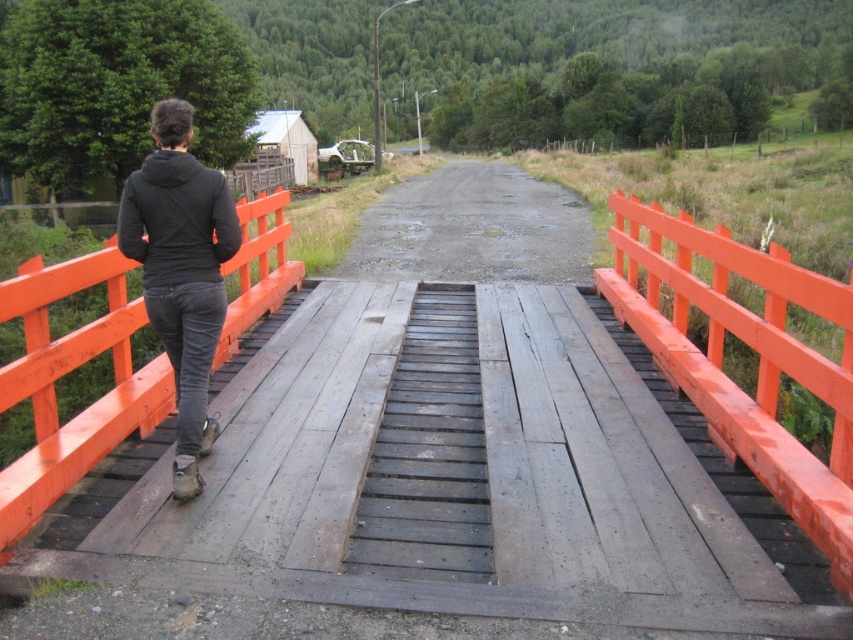
Is orange painted wood at center taller than orange painted wood at left?

Yes, orange painted wood at center is taller than orange painted wood at left.

Which is more to the right, orange painted wood at center or orange painted wood at left?

From the viewer's perspective, orange painted wood at center appears more on the right side.

Find the location of a particular element. Image resolution: width=853 pixels, height=640 pixels. orange painted wood at center is located at coordinates (752, 348).

Can you confirm if orange painted wood at left is positioned above black matte jacket at center?

No, orange painted wood at left is not above black matte jacket at center.

Measure the distance between orange painted wood at left and camera.

4.16 meters

Does point (113, 413) come behind point (177, 454)?

Yes.

Locate an element on the screen. The image size is (853, 640). orange painted wood at left is located at coordinates (67, 372).

Between orange painted wood at center and black matte jacket at upper left, which one has less height?

black matte jacket at upper left is shorter.

From the picture: Which is above, orange painted wood at center or black matte jacket at upper left?

black matte jacket at upper left

Between point (631, 291) and point (183, 198), which one is positioned behind?

Positioned behind is point (631, 291).

This screenshot has height=640, width=853. I want to click on orange painted wood at center, so click(x=752, y=348).